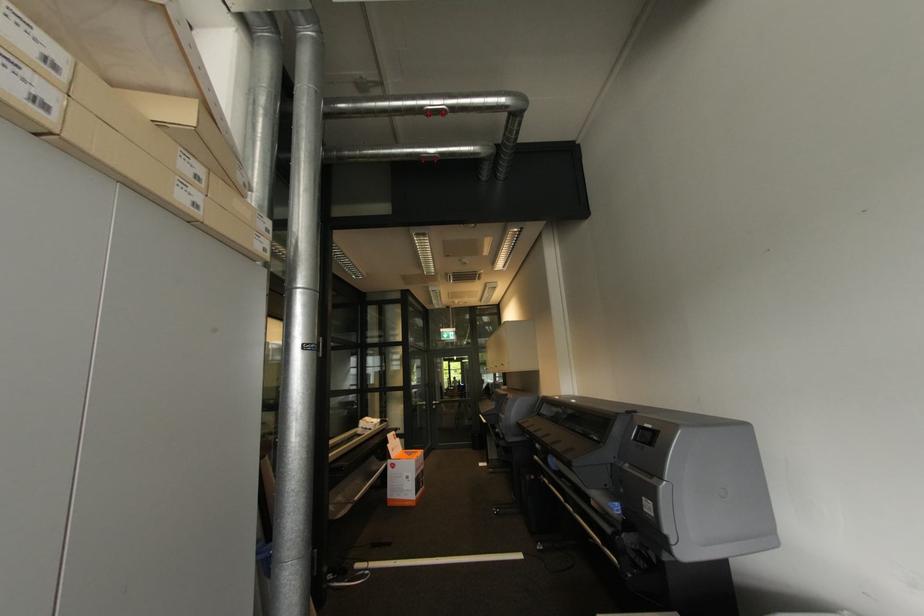
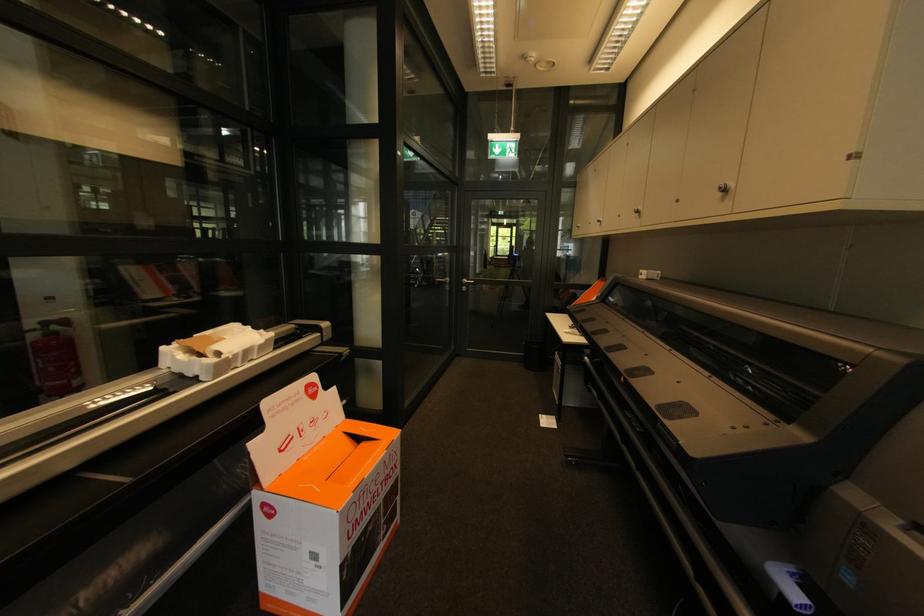
Find the pixel in the second image that matches the point at 406,477 in the first image.

(299, 549)